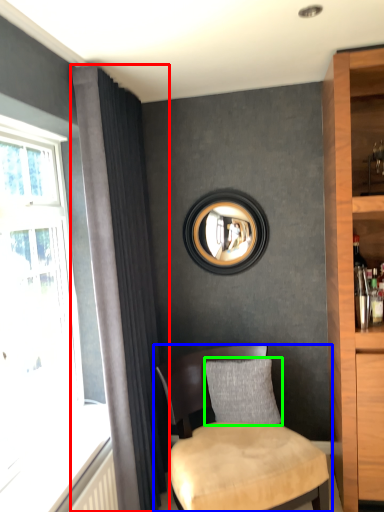
Question: Considering the real-world distances, which object is farthest from curtain (highlighted by a red box)? chair (highlighted by a blue box) or pillow (highlighted by a green box)?

Choices:
 (A) chair
 (B) pillow

Answer: (B)